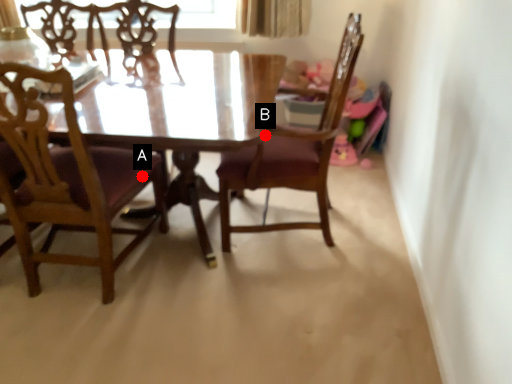
Question: Two points are circled on the image, labeled by A and B beside each circle. Which point is farther from the camera taking this photo?

Choices:
 (A) A is further
 (B) B is further

Answer: (A)